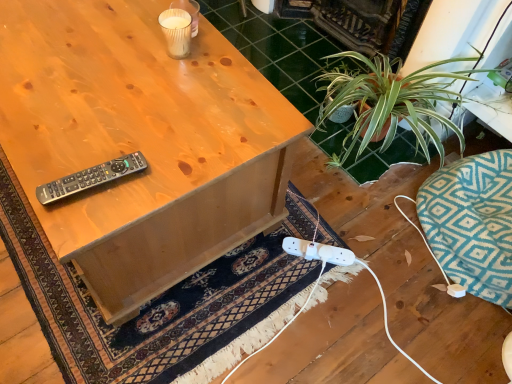
Question: Is black plastic remote at upper left oriented away from matte wood desk at center?

Choices:
 (A) no
 (B) yes

Answer: (A)

Question: From the image's perspective, is black plastic remote at upper left on matte wood desk at center?

Choices:
 (A) no
 (B) yes

Answer: (A)

Question: Considering the relative sizes of black plastic remote at upper left and matte wood desk at center in the image provided, is black plastic remote at upper left smaller than matte wood desk at center?

Choices:
 (A) no
 (B) yes

Answer: (B)

Question: Can you confirm if black plastic remote at upper left is wider than matte wood desk at center?

Choices:
 (A) yes
 (B) no

Answer: (B)

Question: Is black plastic remote at upper left at the right side of matte wood desk at center?

Choices:
 (A) yes
 (B) no

Answer: (A)

Question: Considering the positions of matte wood desk at center and dark blue woven rug at lower center in the image, is matte wood desk at center taller or shorter than dark blue woven rug at lower center?

Choices:
 (A) tall
 (B) short

Answer: (A)

Question: In the image, is matte wood desk at center on the left side or the right side of dark blue woven rug at lower center?

Choices:
 (A) left
 (B) right

Answer: (A)

Question: Is matte wood desk at center wider or thinner than dark blue woven rug at lower center?

Choices:
 (A) wide
 (B) thin

Answer: (B)

Question: Is matte wood desk at center inside or outside of dark blue woven rug at lower center?

Choices:
 (A) inside
 (B) outside

Answer: (B)

Question: From a real-world perspective, is matte wood desk at center physically located above or below black plastic remote at upper left?

Choices:
 (A) above
 (B) below

Answer: (B)

Question: From their relative heights in the image, would you say matte wood desk at center is taller or shorter than black plastic remote at upper left?

Choices:
 (A) tall
 (B) short

Answer: (A)

Question: Considering their positions, is matte wood desk at center located in front of or behind black plastic remote at upper left?

Choices:
 (A) front
 (B) behind

Answer: (A)

Question: From the image's perspective, is matte wood desk at center above or below black plastic remote at upper left?

Choices:
 (A) below
 (B) above

Answer: (B)

Question: Considering the positions of dark blue woven rug at lower center and matte wood desk at center in the image, is dark blue woven rug at lower center wider or thinner than matte wood desk at center?

Choices:
 (A) thin
 (B) wide

Answer: (B)

Question: In the image, is dark blue woven rug at lower center on the left side or the right side of matte wood desk at center?

Choices:
 (A) left
 (B) right

Answer: (B)